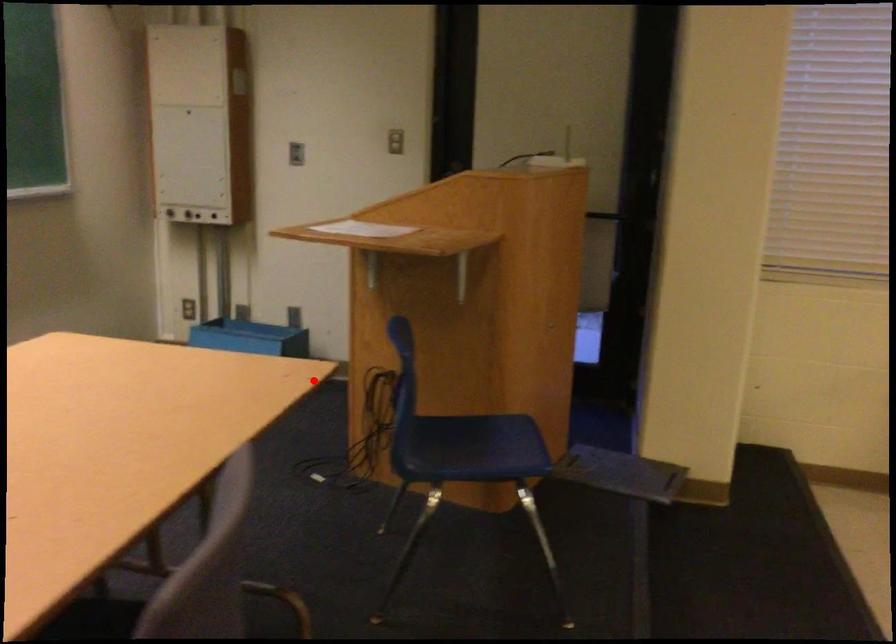
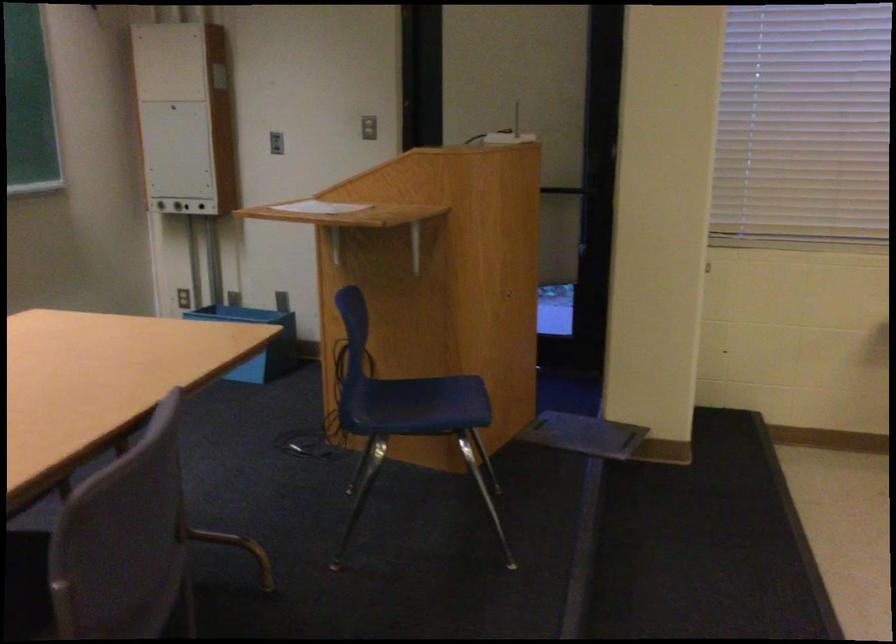
Question: I am providing you with two images of the same scene from different viewpoints. A red point is marked on the first image. Can you still see the location of the red point in image 2?

Choices:
 (A) Yes
 (B) No

Answer: (A)